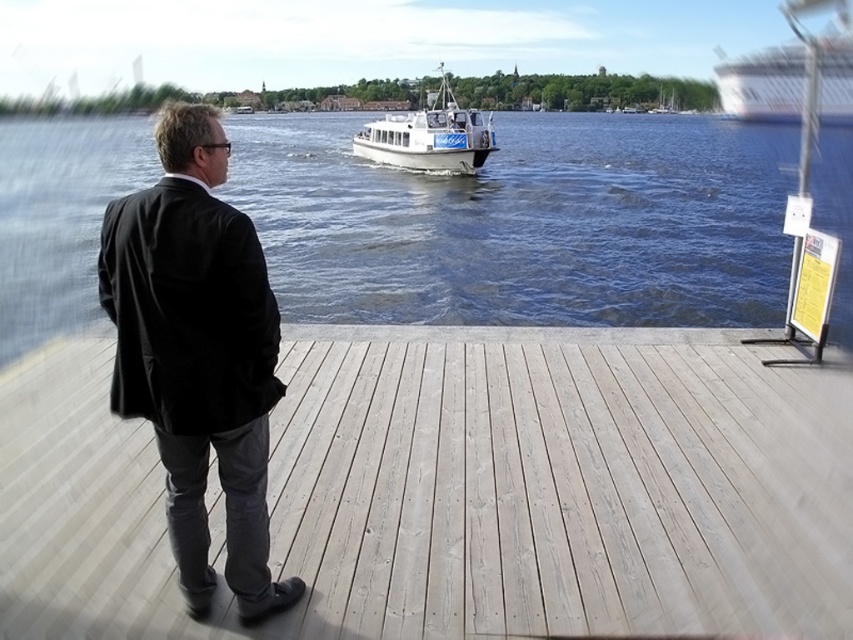
Question: Does light wood dock at center appear on the right side of black fabric coat at center?

Choices:
 (A) yes
 (B) no

Answer: (A)

Question: Which of the following is the farthest from the observer?

Choices:
 (A) white glossy cruise ship at upper right
 (B) light wood dock at center

Answer: (A)

Question: Does black fabric coat at center appear on the right side of white glossy boat at center?

Choices:
 (A) yes
 (B) no

Answer: (B)

Question: Which of these objects is positioned closest to the blue water at center?

Choices:
 (A) white glossy cruise ship at upper right
 (B) black fabric coat at center
 (C) white glossy boat at center

Answer: (C)

Question: Which object appears closest to the camera in this image?

Choices:
 (A) white glossy cruise ship at upper right
 (B) blue water at center

Answer: (B)

Question: Does light wood dock at center have a lesser width compared to white glossy cruise ship at upper right?

Choices:
 (A) yes
 (B) no

Answer: (A)